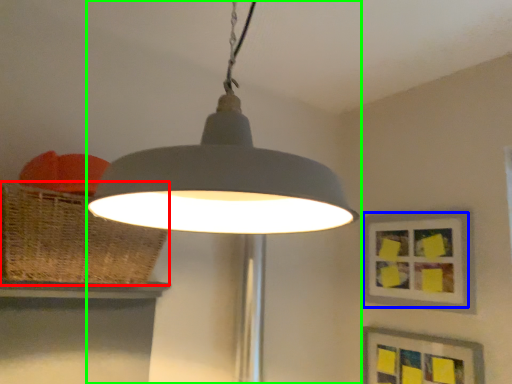
Question: Which object is the farthest from basket (highlighted by a red box)? Choose among these: picture frame (highlighted by a blue box) or lamp (highlighted by a green box).

Choices:
 (A) picture frame
 (B) lamp

Answer: (A)